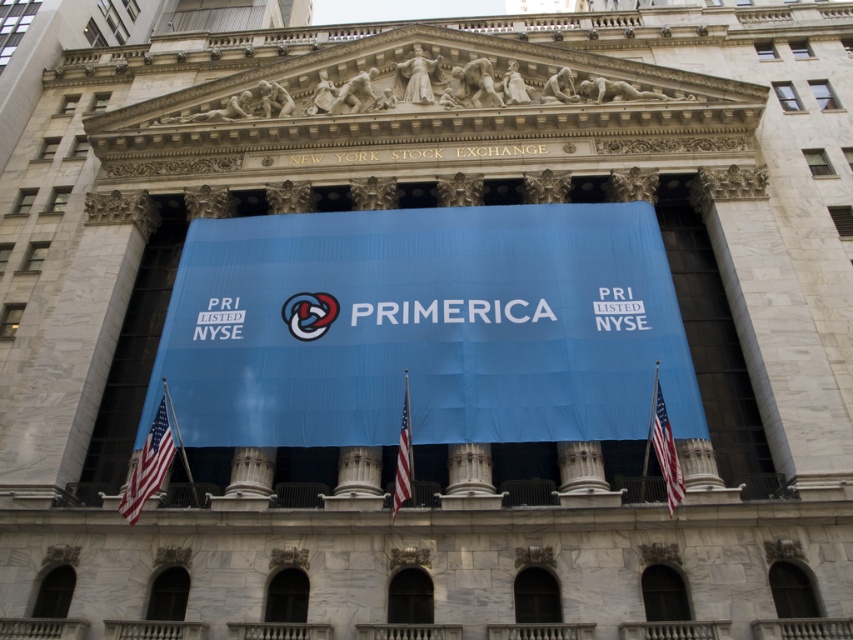
You are a photographer standing in front of the NYSE building. You want to capture both the white fabric flag at lower left and the red fabric flag at right in a single photo. Based on their positions, which flag should you focus on to ensure both are visible in the frame?

The white fabric flag at lower left might be wider than the red fabric flag at right, so focusing on the white fabric flag at lower left would help ensure both are visible as it may occupy more space in the frame.